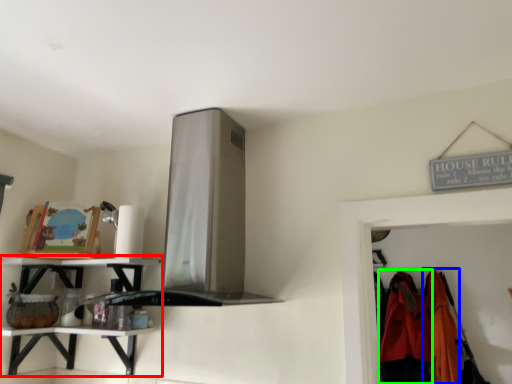
Question: Estimate the real-world distances between objects in this image. Which object is closer to shelf (highlighted by a red box), clothing (highlighted by a blue box) or clothing (highlighted by a green box)?

Choices:
 (A) clothing
 (B) clothing

Answer: (B)